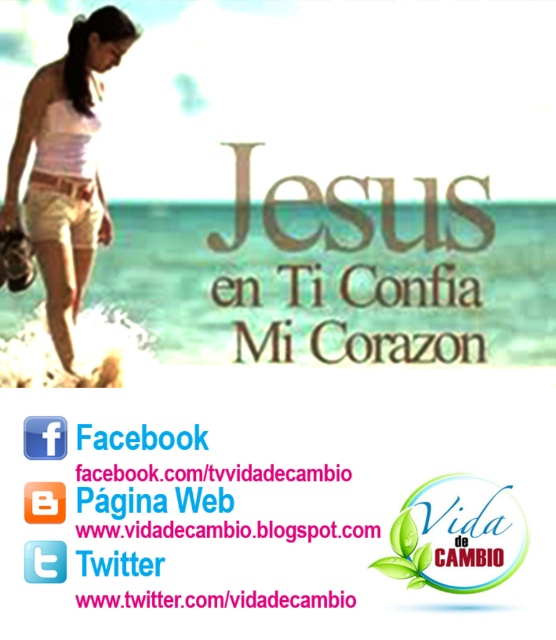
In the scene shown: Is white cotton shorts at left wider than white matte tank top at upper left?

Correct, the width of white cotton shorts at left exceeds that of white matte tank top at upper left.

Who is lower down, white cotton shorts at left or white matte tank top at upper left?

white cotton shorts at left is lower down.

You are a GUI agent. You are given a task and a screenshot of the screen. Output one action in this format:
    pyautogui.click(x=<x>, y=<y>)
    Task: Click on the white cotton shorts at left
    
    Given the screenshot: What is the action you would take?
    pyautogui.click(x=66, y=166)

Locate an element on the screen. white cotton shorts at left is located at coordinates (66, 166).